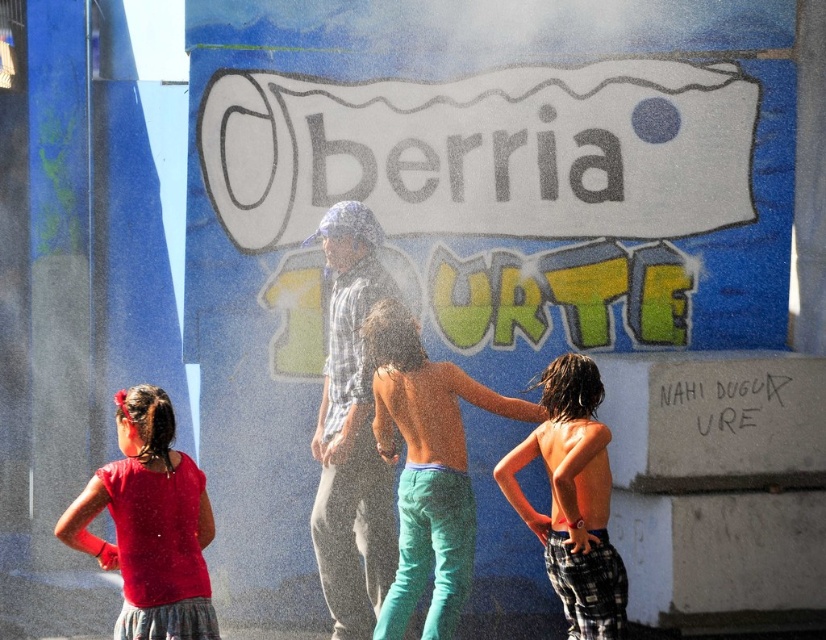
In the scene shown: Which of these two, teal cotton pants at center or plaid cotton shorts at center, stands shorter?

plaid cotton shorts at center is shorter.

You are a GUI agent. You are given a task and a screenshot of the screen. Output one action in this format:
    pyautogui.click(x=<x>, y=<y>)
    Task: Click on the teal cotton pants at center
    The width and height of the screenshot is (826, 640).
    Given the screenshot: What is the action you would take?
    pyautogui.click(x=426, y=468)

Can you confirm if matte red shirt at lower left is taller than plaid cotton shorts at center?

No.

Which is in front, point (171, 534) or point (597, 436)?

Point (171, 534) is in front.

Is point (129, 532) positioned in front of point (565, 465)?

That is True.

You are a GUI agent. You are given a task and a screenshot of the screen. Output one action in this format:
    pyautogui.click(x=<x>, y=<y>)
    Task: Click on the matte red shirt at lower left
    
    Given the screenshot: What is the action you would take?
    pyautogui.click(x=150, y=524)

Is teal cotton pants at center bigger than matte red shirt at lower left?

Correct, teal cotton pants at center is larger in size than matte red shirt at lower left.

Is teal cotton pants at center thinner than matte red shirt at lower left?

In fact, teal cotton pants at center might be wider than matte red shirt at lower left.

Is point (426, 563) in front of point (127, 476)?

That is False.

Find the location of a particular element. teal cotton pants at center is located at coordinates (426, 468).